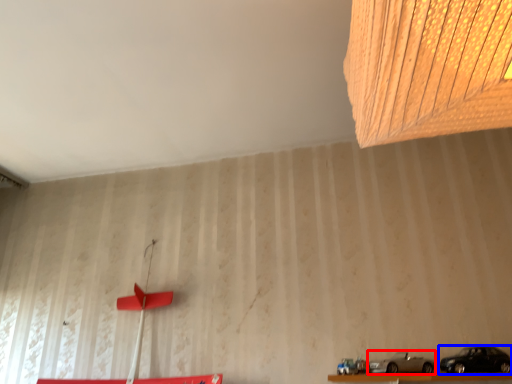
Question: Among these objects, which one is nearest to the camera, car (highlighted by a red box) or car (highlighted by a blue box)?

Choices:
 (A) car
 (B) car

Answer: (B)